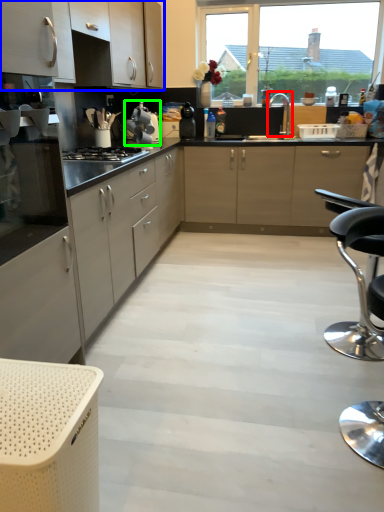
Question: Which is farther away from tap (highlighted by a red box)? cabinetry (highlighted by a blue box) or kitchen appliance (highlighted by a green box)?

Choices:
 (A) cabinetry
 (B) kitchen appliance

Answer: (A)